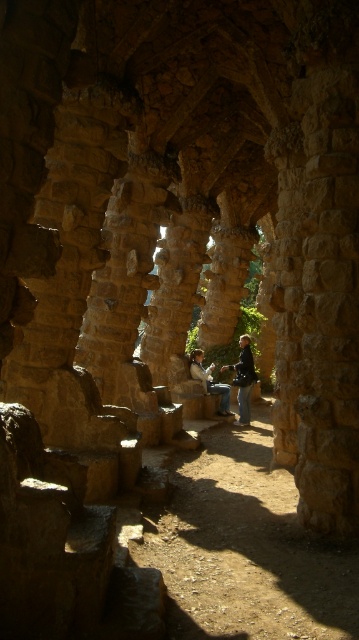
You are an artist looking to sketch the scene. You notice the dark gray fabric jacket at center and the matte brown hair at center. Which object should you draw first if you want to capture the smaller one first?

The dark gray fabric jacket at center has a smaller size compared to the matte brown hair at center, so you should draw the dark gray fabric jacket at center first.

You are an observer standing in front of the architectural structure. You notice a dark gray fabric jacket at center and a matte brown hair at center. Which object is positioned higher up in the scene?

The dark gray fabric jacket at center is located above matte brown hair at center, so it is positioned higher up in the scene.

You are standing in front of the architectural structure with the dark gray fabric jacket at center. If you want to place a small decorative item exactly at the coordinates mentioned in the description, where should you position it relative to the jacket?

The small decorative item should be placed at the exact location of the dark gray fabric jacket at center since the coordinates provided in the description correspond to its position.